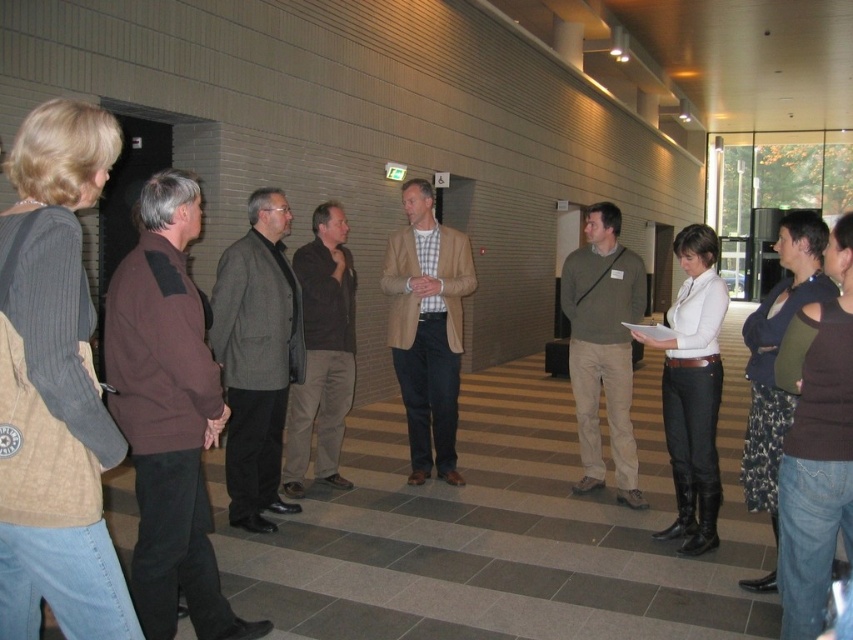
Between denim jeans at center and matte green sweater at center, which one has less height?

denim jeans at center

Measure the distance between denim jeans at center and matte green sweater at center.

The distance of denim jeans at center from matte green sweater at center is 7.28 feet.

In order to click on denim jeans at center in this screenshot , I will do `click(817, 452)`.

Does brown fabric jacket at left have a greater width compared to matte green sweater at center?

Yes.

Which is behind, point (155, 193) or point (622, 387)?

The point (622, 387) is behind.

Identify the location of brown fabric jacket at left. (167, 413).

Does matte green sweater at center have a greater width compared to white matte shirt at center?

In fact, matte green sweater at center might be narrower than white matte shirt at center.

Does matte green sweater at center appear on the left side of white matte shirt at center?

Correct, you'll find matte green sweater at center to the left of white matte shirt at center.

At what (x,y) coordinates should I click in order to perform the action: click on matte green sweater at center. Please return your answer as a coordinate pair (x, y). This screenshot has height=640, width=853. Looking at the image, I should click on [x=602, y=346].

Where is `matte green sweater at center`? This screenshot has width=853, height=640. matte green sweater at center is located at coordinates (602, 346).